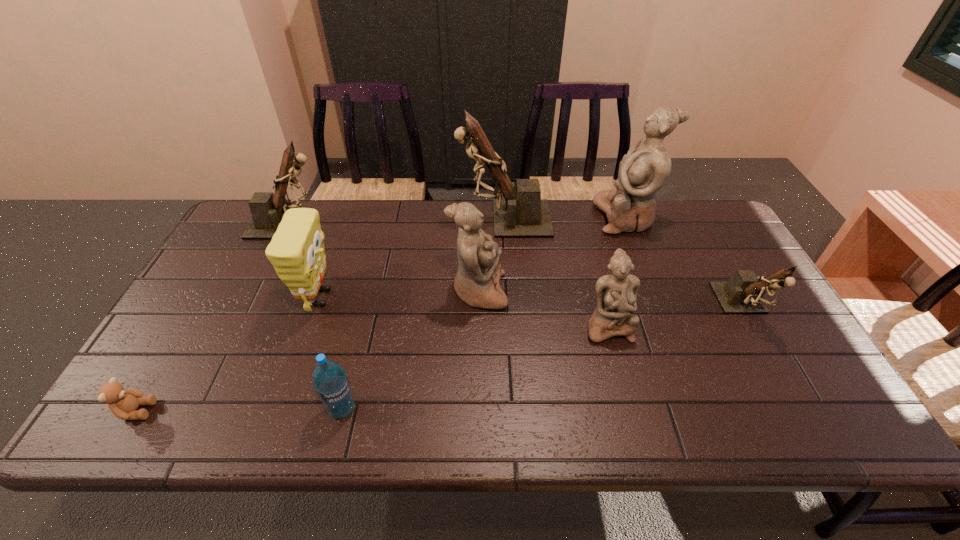
At what (x,y) coordinates should I click in order to perform the action: click on the biggest white figurine. Please return your answer as a coordinate pair (x, y). The height and width of the screenshot is (540, 960). Looking at the image, I should click on (644, 170).

Locate an element on the screen. The width and height of the screenshot is (960, 540). the second brown figurine from left to right is located at coordinates (522, 214).

Locate an element on the screen. the second biggest brown figurine is located at coordinates (267, 209).

This screenshot has height=540, width=960. I want to click on the leftmost figurine, so click(x=267, y=209).

This screenshot has height=540, width=960. Identify the location of the leftmost white figurine. (477, 280).

In order to click on the third object from left to right in this screenshot , I will do `click(296, 251)`.

At what (x,y) coordinates should I click in order to perform the action: click on the smallest white figurine. Please return your answer as a coordinate pair (x, y). The width and height of the screenshot is (960, 540). Looking at the image, I should click on (616, 295).

The width and height of the screenshot is (960, 540). Find the location of `the nearest brown figurine`. the nearest brown figurine is located at coordinates (743, 293).

Find the location of a particular element. the rightmost figurine is located at coordinates (743, 293).

Locate an element on the screen. the eighth tallest object is located at coordinates (330, 381).